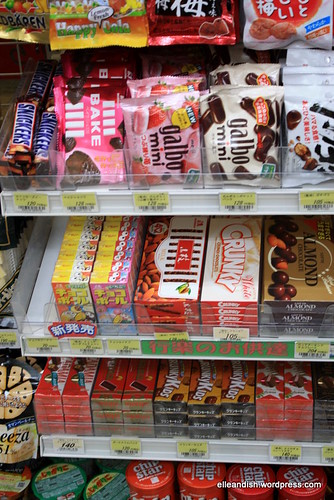
Where is `chinese candy box`? chinese candy box is located at coordinates pos(75,291), pos(124,299).